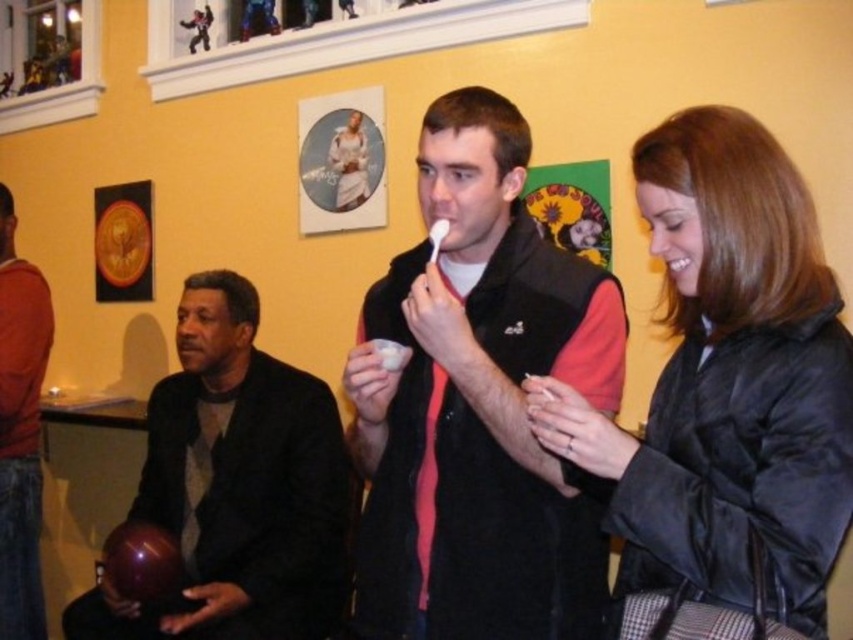
You are at a party and want to know which clothing item takes up more space between the black puffy jacket at center and the black matte vest at center. Which one should you choose?

The black matte vest at center occupies more space than the black puffy jacket at center, so you should choose the black matte vest at center if you want the item that takes up more space.

In the scene shown: You are at a party and want to know which person is shorter between the black puffy jacket at center and the orange cotton shirt at left. Can you determine this based on their positions?

The black puffy jacket at center has a lesser height compared to orange cotton shirt at left, so the person wearing the black puffy jacket at center is shorter.

You are at a party and want to greet the person wearing the orange cotton shirt at left. Which direction should you move from the black puffy jacket at center to reach them?

The orange cotton shirt at left is to the left of the black puffy jacket at center, so you should move to the left from the black puffy jacket at center to reach them.